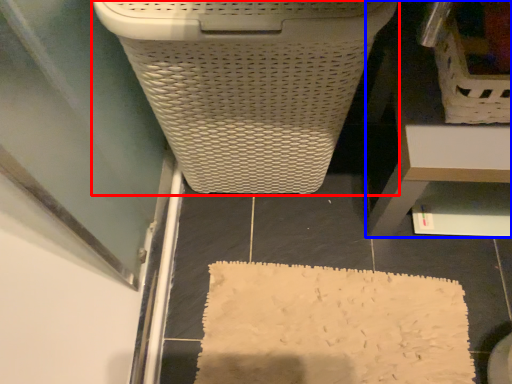
Question: Which point is further to the camera, waste container (highlighted by a red box) or furniture (highlighted by a blue box)?

Choices:
 (A) waste container
 (B) furniture

Answer: (B)